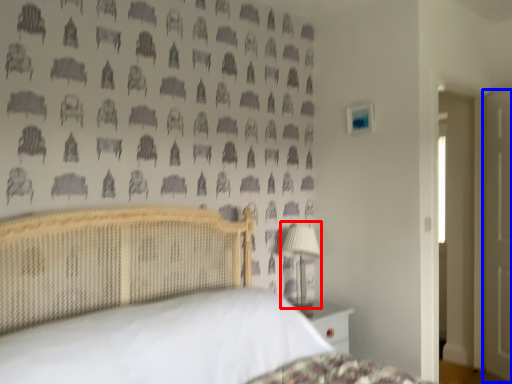
Question: Which of the following is the farthest to the observer, table lamp (highlighted by a red box) or door (highlighted by a blue box)?

Choices:
 (A) table lamp
 (B) door

Answer: (B)